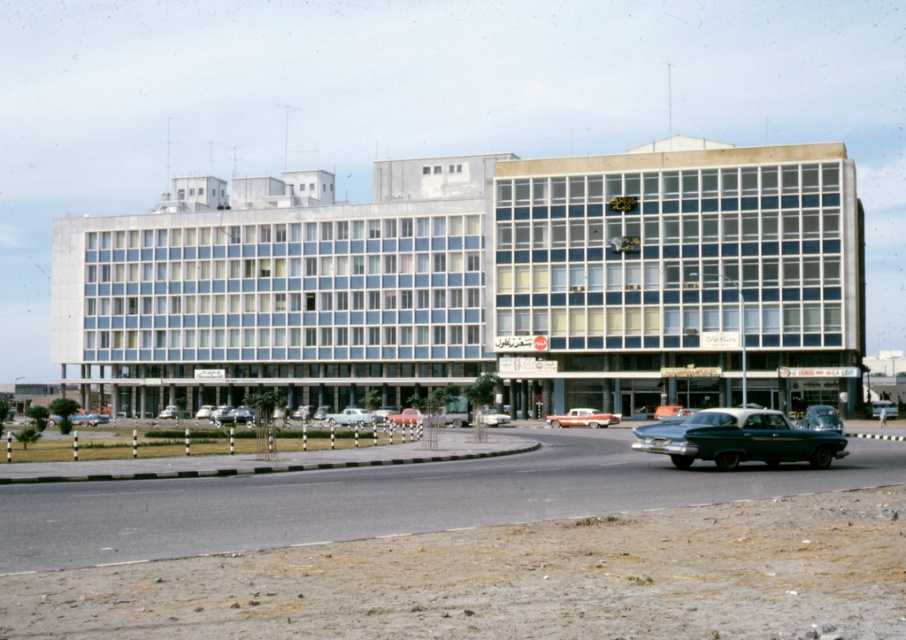
You are standing in front of the building and want to take a photo that includes both the point at coordinates point [748,428] and point [358,417]. Which point will appear larger in your photo?

Point [748,428] will appear larger in the photo because it is closer to the camera than point [358,417].

You are a pedestrian standing on the sidewalk in front of the building. You see a light blue metallic sedan at center and a matte red car at center. Which car is closer to you?

The light blue metallic sedan at center is closer to the viewer than the matte red car at center.